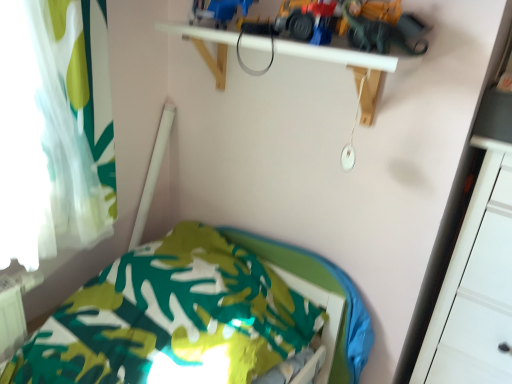
Question: Does metallic yellow construction vehicle at upper center, the 1th toy in the right-to-left sequence, come behind white sheer curtain at left?

Choices:
 (A) yes
 (B) no

Answer: (A)

Question: From a real-world perspective, is metallic yellow construction vehicle at upper center, the 1th toy in the right-to-left sequence, beneath white sheer curtain at left?

Choices:
 (A) no
 (B) yes

Answer: (A)

Question: Are metallic yellow construction vehicle at upper center, which is the second toy in left-to-right order, and white sheer curtain at left far apart?

Choices:
 (A) no
 (B) yes

Answer: (A)

Question: Is metallic yellow construction vehicle at upper center, the 1th toy in the right-to-left sequence, outside white sheer curtain at left?

Choices:
 (A) no
 (B) yes

Answer: (B)

Question: From the image's perspective, is metallic yellow construction vehicle at upper center, the 1th toy in the right-to-left sequence, over white sheer curtain at left?

Choices:
 (A) yes
 (B) no

Answer: (A)

Question: From the image's perspective, does metallic yellow construction vehicle at upper center, the 1th toy in the right-to-left sequence, appear lower than white sheer curtain at left?

Choices:
 (A) yes
 (B) no

Answer: (B)

Question: Is green fabric bed at lower left positioned in front of yellow plastic toy car at upper center, arranged as the first toy car when viewed from the right?

Choices:
 (A) no
 (B) yes

Answer: (B)

Question: Is green fabric bed at lower left positioned with its back to yellow plastic toy car at upper center, arranged as the first toy car when viewed from the right?

Choices:
 (A) no
 (B) yes

Answer: (A)

Question: Can you confirm if green fabric bed at lower left is bigger than yellow plastic toy car at upper center, placed as the second toy car when sorted from left to right?

Choices:
 (A) yes
 (B) no

Answer: (A)

Question: Does green fabric bed at lower left have a greater height compared to yellow plastic toy car at upper center, placed as the second toy car when sorted from left to right?

Choices:
 (A) no
 (B) yes

Answer: (B)

Question: Are green fabric bed at lower left and yellow plastic toy car at upper center, arranged as the first toy car when viewed from the right, making contact?

Choices:
 (A) no
 (B) yes

Answer: (A)

Question: From a real-world perspective, is green fabric bed at lower left below yellow plastic toy car at upper center, arranged as the first toy car when viewed from the right?

Choices:
 (A) no
 (B) yes

Answer: (B)

Question: Is white sheer curtain at left closer to camera compared to blue plastic toy truck at upper center, the 1th toy positioned from the left?

Choices:
 (A) yes
 (B) no

Answer: (A)